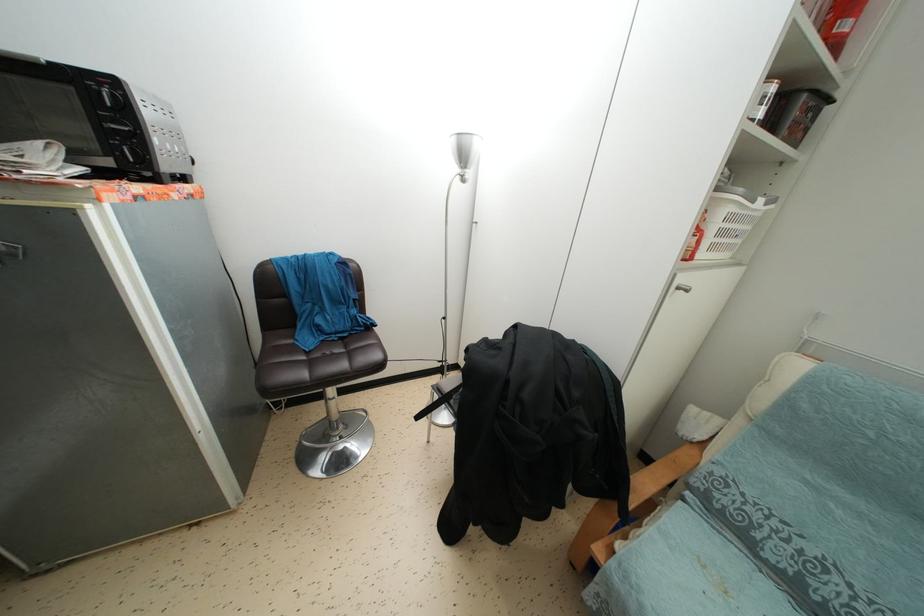
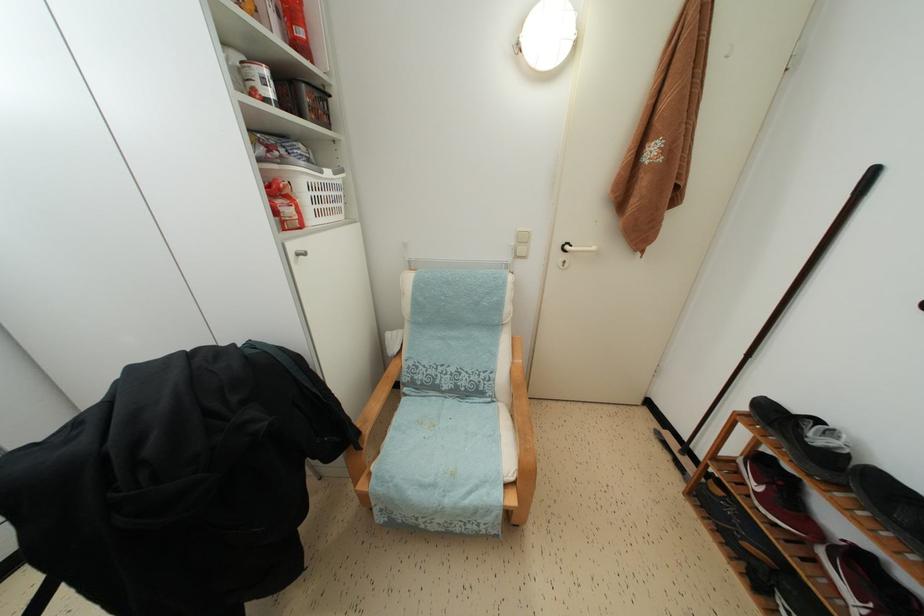
Find the pixel in the second image that matches the point at 764,119 in the first image.

(274, 100)